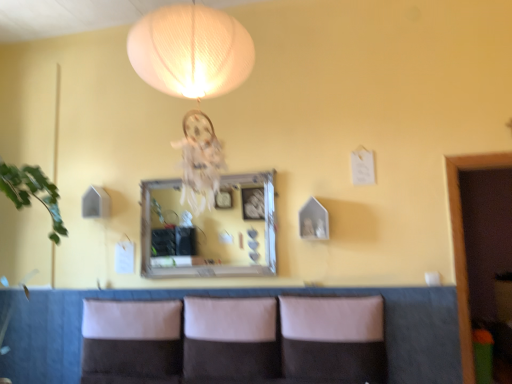
Question: Would you say leather-like brown couch at lower center is inside or outside white fabric pillow at lower center, which is the first pillow in left-to-right order?

Choices:
 (A) outside
 (B) inside

Answer: (A)

Question: From the image's perspective, is leather-like brown couch at lower center above or below white fabric pillow at lower center, which is counted as the 3th pillow, starting from the right?

Choices:
 (A) above
 (B) below

Answer: (B)

Question: Based on their relative distances, which object is farther from the white fabric pillow at lower center, which is counted as the 3th pillow, starting from the right?

Choices:
 (A) leather-like brown couch at lower center
 (B) suede-like beige pillow at center, which appears as the second pillow when viewed from the left
 (C) leather-like beige pillow at center, which is the 3th pillow from left to right
 (D) wooden-framed mirror at center

Answer: (C)

Question: Which object is the closest to the suede-like beige pillow at center, the 2th pillow positioned from the right?

Choices:
 (A) leather-like beige pillow at center, the 1th pillow from the right
 (B) leather-like brown couch at lower center
 (C) white fabric pillow at lower center, which is the first pillow in left-to-right order
 (D) wooden-framed mirror at center

Answer: (A)